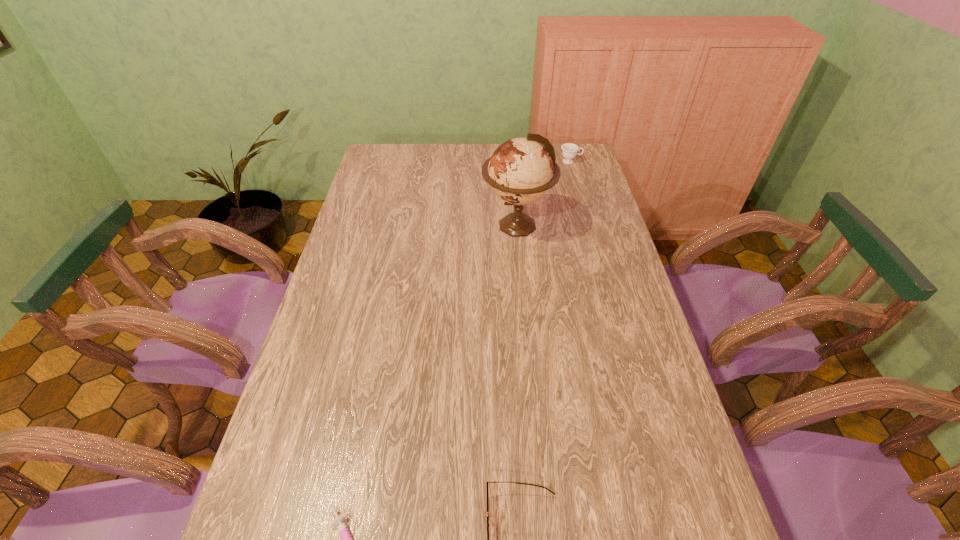
Find the location of a particular element. the tallest object is located at coordinates (520, 171).

At what (x,y) coordinates should I click in order to perform the action: click on globe. Please return your answer as a coordinate pair (x, y). This screenshot has height=540, width=960. Looking at the image, I should click on point(520,171).

Image resolution: width=960 pixels, height=540 pixels. Identify the location of teacup. (569, 150).

Where is `the rightmost object`? The height and width of the screenshot is (540, 960). the rightmost object is located at coordinates (569, 150).

Locate an element on the screen. vacant area located on the front of the globe showing Asia is located at coordinates (427, 225).

Find the location of a particular element. This screenshot has width=960, height=540. vacant region located on the front of the globe showing Asia is located at coordinates (385, 225).

Find the location of a particular element. This screenshot has width=960, height=540. vacant space located on the front of the globe showing Asia is located at coordinates (444, 225).

Image resolution: width=960 pixels, height=540 pixels. I want to click on object that is at the far edge, so click(x=569, y=150).

Locate an element on the screen. object located at the right edge is located at coordinates (569, 150).

Image resolution: width=960 pixels, height=540 pixels. Identify the location of object situated at the far right corner. (569, 150).